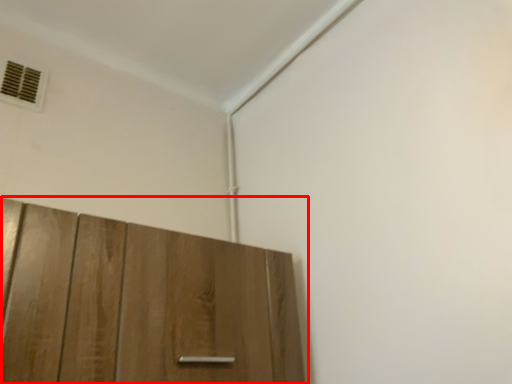
Question: From the image's perspective, what is the correct spatial positioning of cupboard (annotated by the red box) in reference to air conditioning?

Choices:
 (A) above
 (B) below

Answer: (B)